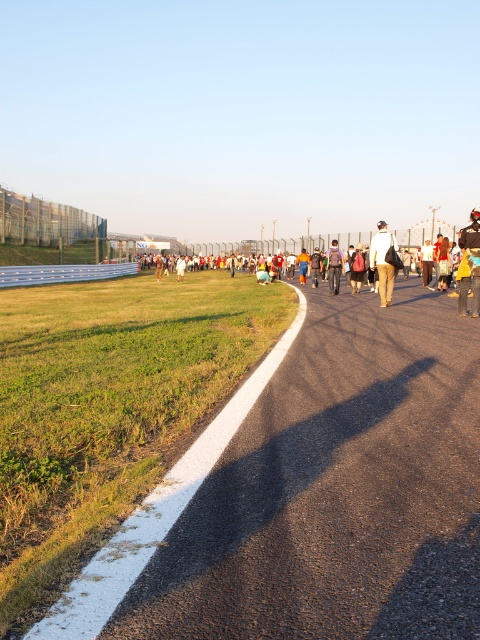
Question: Does asphalt at center have a greater width compared to white casual clothing at center?

Choices:
 (A) no
 (B) yes

Answer: (A)

Question: Among these points, which one is farthest from the camera?

Choices:
 (A) (334, 273)
 (B) (478, 284)
 (C) (380, 289)
 (D) (418, 611)

Answer: (A)

Question: Is white casual clothing at center to the right of khaki pants at center from the viewer's perspective?

Choices:
 (A) yes
 (B) no

Answer: (A)

Question: Which object appears farthest from the camera in this image?

Choices:
 (A) matte black jacket at center
 (B) asphalt at center

Answer: (A)

Question: Which of the following is the closest to the observer?

Choices:
 (A) (387, 272)
 (B) (360, 252)
 (C) (144, 620)
 (D) (337, 262)

Answer: (C)

Question: Is the position of asphalt at center more distant than that of khaki pants at center?

Choices:
 (A) yes
 (B) no

Answer: (B)